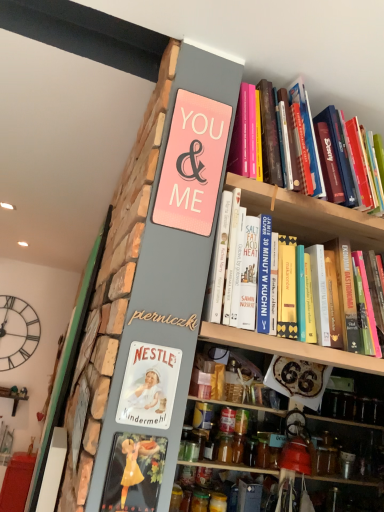
Question: Could translucent glass jar at lower center, which appears as the 2th glass jar when viewed from the left, be considered to be inside pink matte sign at upper center?

Choices:
 (A) yes
 (B) no

Answer: (B)

Question: Does pink matte sign at upper center have a lesser width compared to translucent glass jar at lower center, the first glass jar when ordered from right to left?

Choices:
 (A) no
 (B) yes

Answer: (B)

Question: Considering the relative positions of pink matte sign at upper center and translucent glass jar at lower center, which appears as the 2th glass jar when viewed from the left, in the image provided, is pink matte sign at upper center in front of translucent glass jar at lower center, which appears as the 2th glass jar when viewed from the left,?

Choices:
 (A) yes
 (B) no

Answer: (A)

Question: From the image's perspective, is pink matte sign at upper center beneath translucent glass jar at lower center, which appears as the 2th glass jar when viewed from the left?

Choices:
 (A) no
 (B) yes

Answer: (A)

Question: Is translucent glass jar at lower center, which appears as the 2th glass jar when viewed from the left, at the back of pink matte sign at upper center?

Choices:
 (A) yes
 (B) no

Answer: (B)

Question: Is gold wood sign at center situated inside black metal clock at upper left or outside?

Choices:
 (A) inside
 (B) outside

Answer: (B)

Question: From the image's perspective, is gold wood sign at center located above or below black metal clock at upper left?

Choices:
 (A) below
 (B) above

Answer: (B)

Question: Looking at their shapes, would you say gold wood sign at center is wider or thinner than black metal clock at upper left?

Choices:
 (A) thin
 (B) wide

Answer: (A)

Question: Does point (140, 318) appear closer or farther from the camera than point (6, 370)?

Choices:
 (A) farther
 (B) closer

Answer: (B)

Question: From their relative heights in the image, would you say hardcover book at upper right, positioned as the 1th book in bottom-to-top order, is taller or shorter than translucent glass jar at center, arranged as the 1th glass jar when viewed from the left?

Choices:
 (A) short
 (B) tall

Answer: (B)

Question: Looking at their shapes, would you say hardcover book at upper right, acting as the second book starting from the top, is wider or thinner than translucent glass jar at center, arranged as the 1th glass jar when viewed from the left?

Choices:
 (A) wide
 (B) thin

Answer: (A)

Question: Considering the positions of point (249, 200) and point (193, 508), is point (249, 200) closer or farther from the camera than point (193, 508)?

Choices:
 (A) farther
 (B) closer

Answer: (B)

Question: From the image's perspective, is hardcover book at upper right, positioned as the 1th book in bottom-to-top order, positioned above or below translucent glass jar at center, the second glass jar viewed from the right?

Choices:
 (A) above
 (B) below

Answer: (A)

Question: Considering their positions, is hardcover books at upper right, which is counted as the first book, starting from the top, located in front of or behind wooden shelf at center?

Choices:
 (A) front
 (B) behind

Answer: (A)

Question: From the image's perspective, relative to wooden shelf at center, is hardcover books at upper right, which is counted as the first book, starting from the top, above or below?

Choices:
 (A) above
 (B) below

Answer: (A)